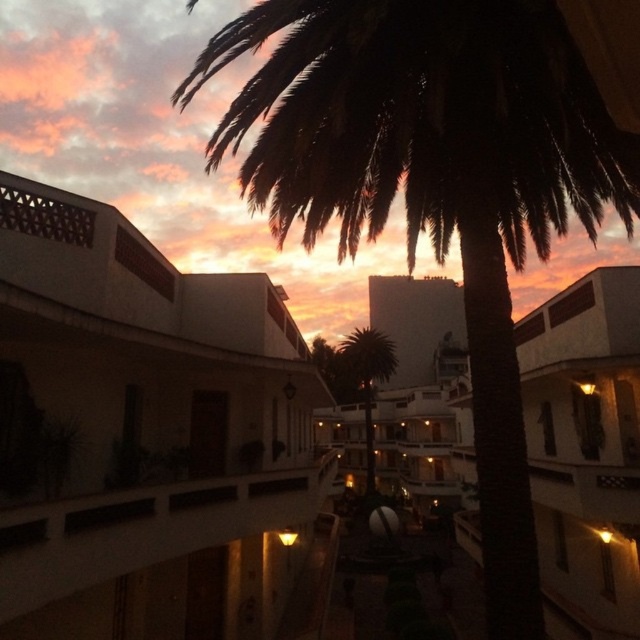
Between white matte building at upper left and dark green leafy palm tree at upper center, which one appears on the left side from the viewer's perspective?

From the viewer's perspective, white matte building at upper left appears more on the left side.

Find the location of `white matte building at upper left`. white matte building at upper left is located at coordinates (144, 433).

At what (x,y) coordinates should I click in order to perform the action: click on white matte building at upper left. Please return your answer as a coordinate pair (x, y). The image size is (640, 640). Looking at the image, I should click on (144, 433).

Can you confirm if dark green leafy palm tree at upper center is taller than green leafy palm tree at center?

In fact, dark green leafy palm tree at upper center may be shorter than green leafy palm tree at center.

Looking at this image, between dark green leafy palm tree at upper center and green leafy palm tree at center, which one has less height?

dark green leafy palm tree at upper center is shorter.

Does point (637, 179) come closer to viewer compared to point (378, 362)?

That is True.

Identify the location of dark green leafy palm tree at upper center. This screenshot has width=640, height=640. (436, 182).

Between point (204, 444) and point (340, 362), which one is positioned in front?

Point (204, 444) is in front.

The height and width of the screenshot is (640, 640). Find the location of `white matte building at upper left`. white matte building at upper left is located at coordinates (144, 433).

Is point (173, 468) positioned behind point (364, 385)?

No, (173, 468) is closer to viewer.

The image size is (640, 640). What are the coordinates of `white matte building at upper left` in the screenshot? It's located at (144, 433).